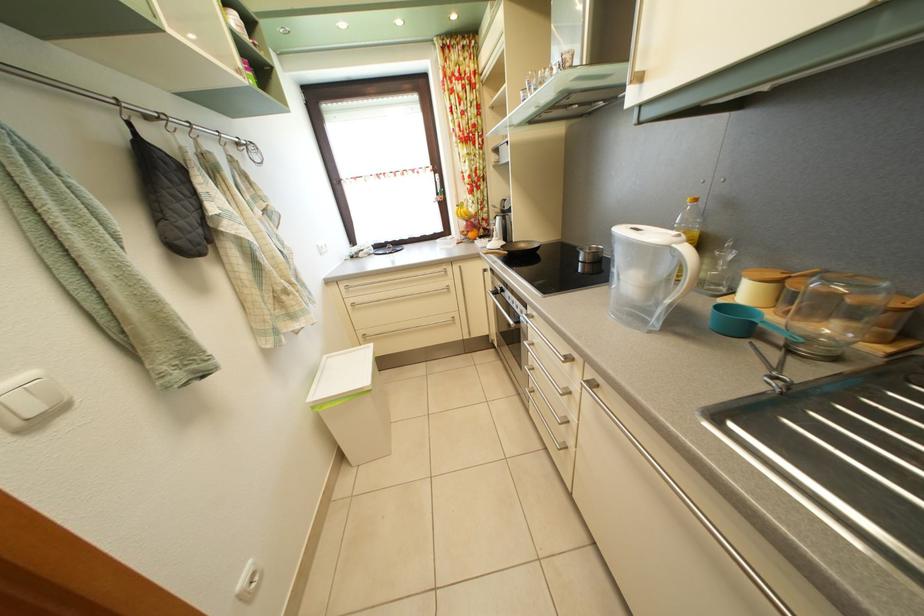
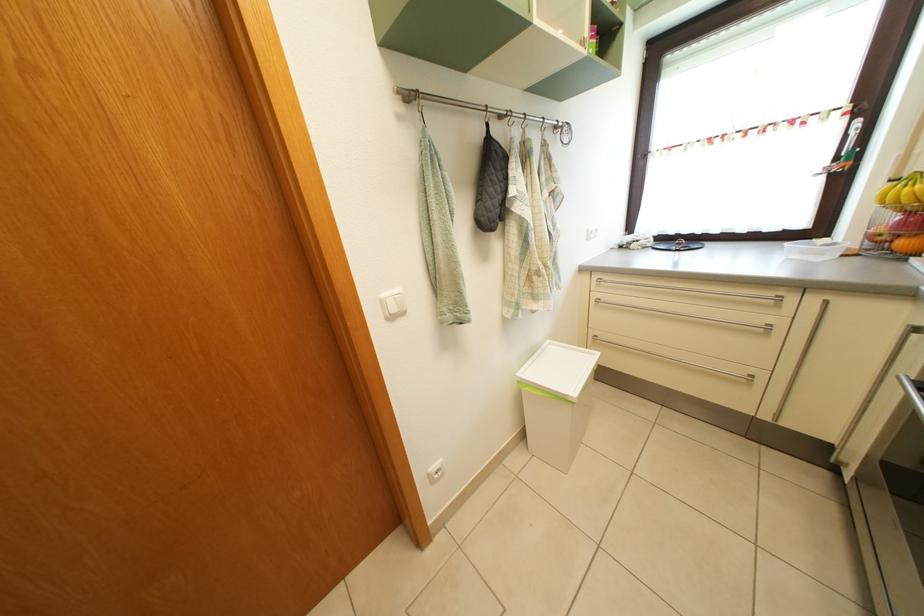
Find the pixel in the second image that matches point (335, 365) in the first image.

(557, 352)